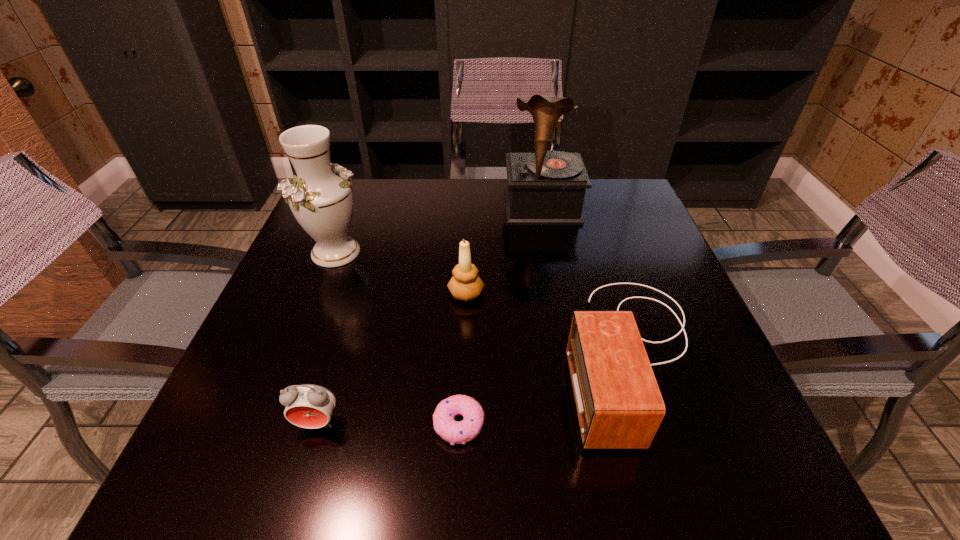
Locate an element on the screen. phonograph_record is located at coordinates (547, 187).

Identify the location of vase. The width and height of the screenshot is (960, 540). (322, 201).

Find the location of a particular element. This screenshot has width=960, height=540. candle_holder is located at coordinates (465, 284).

In order to click on radio receiver in this screenshot , I will do `click(618, 403)`.

The image size is (960, 540). In order to click on alarm clock in this screenshot , I will do `click(310, 406)`.

Image resolution: width=960 pixels, height=540 pixels. Find the location of `the shortest object`. the shortest object is located at coordinates (456, 432).

Identify the location of free space located at the horn opening of the phonograph_record. The width and height of the screenshot is (960, 540). (555, 277).

The image size is (960, 540). I want to click on free space located on the front of the second farthest object, so click(x=267, y=430).

Find the location of a particular element. The image size is (960, 540). vacant region located 0.320m on the front of the third tallest object is located at coordinates (461, 451).

This screenshot has width=960, height=540. In order to click on free location located 0.380m on the front-facing side of the radio receiver in this screenshot , I will do `click(365, 354)`.